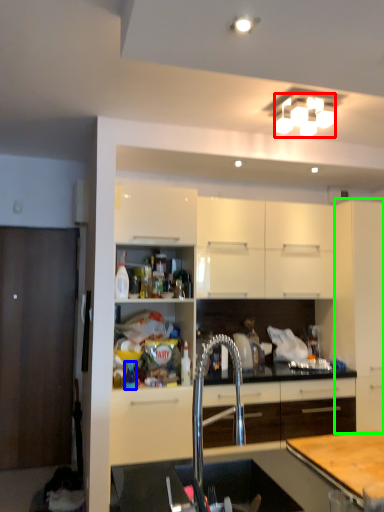
Question: Based on their relative distances, which object is nearer to light fixture (highlighted by a red box)? Choose from bottle (highlighted by a blue box) and cabinetry (highlighted by a green box).

Choices:
 (A) bottle
 (B) cabinetry

Answer: (B)